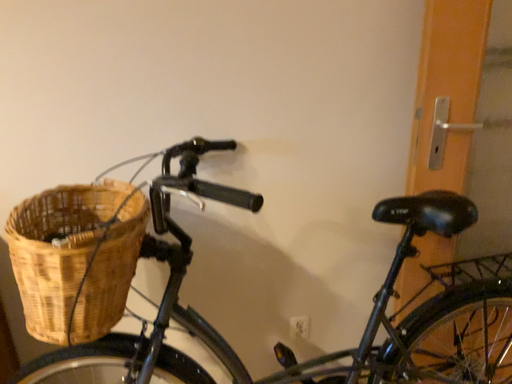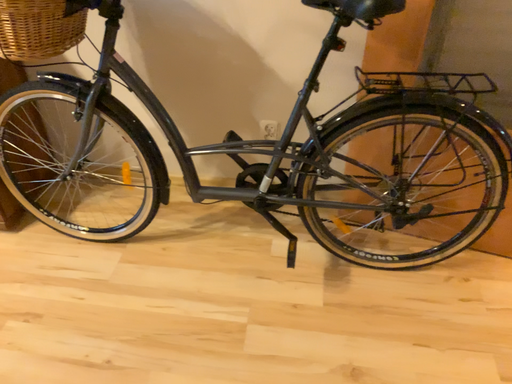
Question: Which way did the camera rotate in the video?

Choices:
 (A) rotated upward
 (B) rotated downward

Answer: (B)